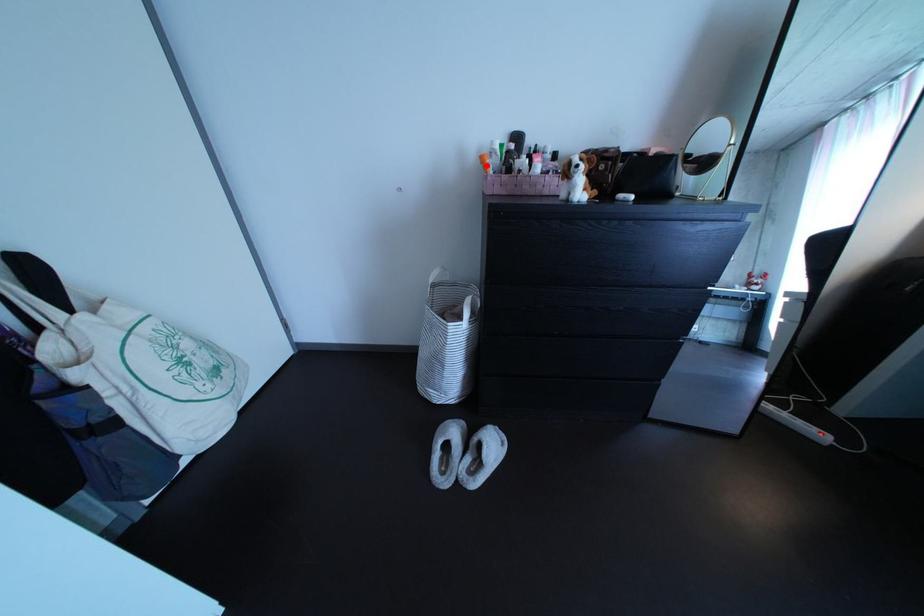
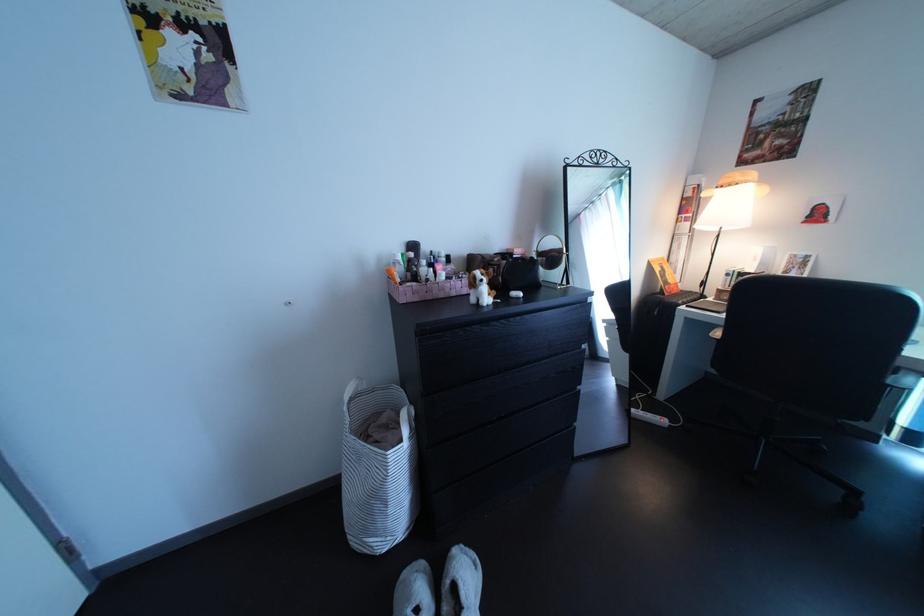
Find the pixel in the second image that matches the highlighted location in the first image.

(386, 273)